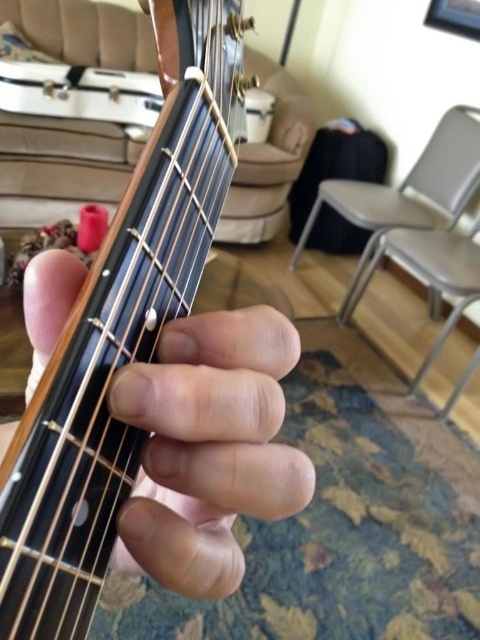
You are a photographer setting up a shoot with the wooden acoustic guitar at center and the wooden guitar neck at center in the frame. You want to ensure the guitar neck is visible in the background. Based on their positions, is the guitar neck already positioned behind the acoustic guitar?

Yes, the wooden acoustic guitar at center is in front of the wooden guitar neck at center, so the guitar neck is already positioned behind the acoustic guitar.

Based on the scene description, what is the 2D coordinate of the wooden acoustic guitar at center?

The 2D coordinate of the wooden acoustic guitar at center is at point (x=120, y=332).

You are a photographer trying to capture the acoustic guitar in the scene. Since the wooden acoustic guitar at center and wooden guitar neck at center are both in the frame, which one should you focus on if you want to highlight the main body of the guitar?

The wooden acoustic guitar at center is to the right of the wooden guitar neck at center, so focusing on the wooden acoustic guitar at center will highlight the main body of the guitar.